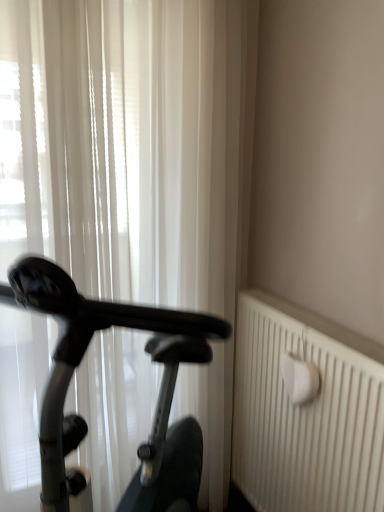
Question: Could you tell me if black glossy exercise bike at left is turned towards white sheer curtain at left?

Choices:
 (A) yes
 (B) no

Answer: (B)

Question: From a real-world perspective, is black glossy exercise bike at left beneath white sheer curtain at left?

Choices:
 (A) no
 (B) yes

Answer: (B)

Question: Is black glossy exercise bike at left wider than white sheer curtain at left?

Choices:
 (A) yes
 (B) no

Answer: (A)

Question: Is black glossy exercise bike at left with white sheer curtain at left?

Choices:
 (A) no
 (B) yes

Answer: (A)

Question: Is the position of black glossy exercise bike at left less distant than that of white sheer curtain at left?

Choices:
 (A) yes
 (B) no

Answer: (A)

Question: Is white sheer curtain at left inside the boundaries of white textured radiator at right, or outside?

Choices:
 (A) outside
 (B) inside

Answer: (A)

Question: Considering the relative positions of white sheer curtain at left and white textured radiator at right in the image provided, is white sheer curtain at left to the left or to the right of white textured radiator at right?

Choices:
 (A) left
 (B) right

Answer: (A)

Question: Based on their sizes in the image, would you say white sheer curtain at left is bigger or smaller than white textured radiator at right?

Choices:
 (A) small
 (B) big

Answer: (B)

Question: From the image's perspective, relative to white textured radiator at right, is white sheer curtain at left above or below?

Choices:
 (A) above
 (B) below

Answer: (A)

Question: Would you say white textured radiator at right is to the left or to the right of black glossy exercise bike at left in the picture?

Choices:
 (A) left
 (B) right

Answer: (B)

Question: Considering their positions, is white textured radiator at right located in front of or behind black glossy exercise bike at left?

Choices:
 (A) front
 (B) behind

Answer: (B)

Question: From a real-world perspective, is white textured radiator at right positioned above or below black glossy exercise bike at left?

Choices:
 (A) below
 (B) above

Answer: (A)

Question: Is white textured radiator at right wider or thinner than black glossy exercise bike at left?

Choices:
 (A) thin
 (B) wide

Answer: (A)

Question: From the image's perspective, relative to white textured radiator at right, is black glossy exercise bike at left above or below?

Choices:
 (A) below
 (B) above

Answer: (B)

Question: Is black glossy exercise bike at left wider or thinner than white textured radiator at right?

Choices:
 (A) thin
 (B) wide

Answer: (B)